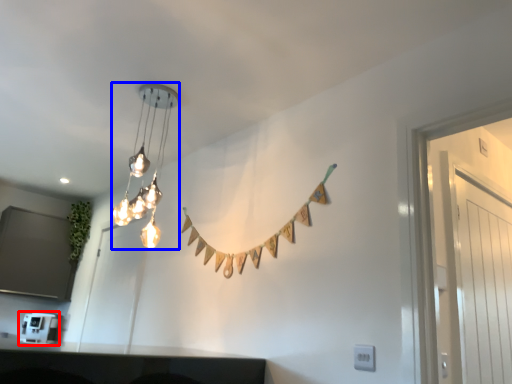
Question: Which point is further to the camera, appliance (highlighted by a red box) or lamp (highlighted by a blue box)?

Choices:
 (A) appliance
 (B) lamp

Answer: (A)